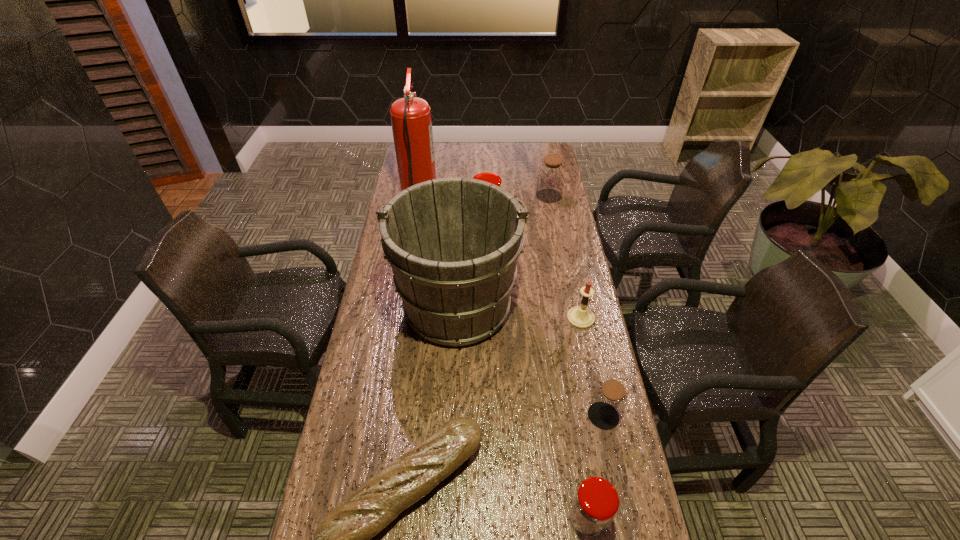
This screenshot has height=540, width=960. Identify the location of fire extinguisher. (411, 121).

Locate an element on the screen. the tallest object is located at coordinates (411, 121).

What are the coordinates of `the seventh shortest object` in the screenshot? It's located at (453, 244).

Where is `the farthest jar`? This screenshot has height=540, width=960. the farthest jar is located at coordinates (551, 175).

I want to click on the farther brown jar, so click(x=551, y=175).

The width and height of the screenshot is (960, 540). I want to click on the bigger red jar, so click(495, 179).

The height and width of the screenshot is (540, 960). Find the location of `the farther red jar`. the farther red jar is located at coordinates (495, 179).

I want to click on red candle, so pos(581,317).

In order to click on the second nearest jar in this screenshot , I will do `click(609, 400)`.

Where is `the nearer brown jar`? the nearer brown jar is located at coordinates (609, 400).